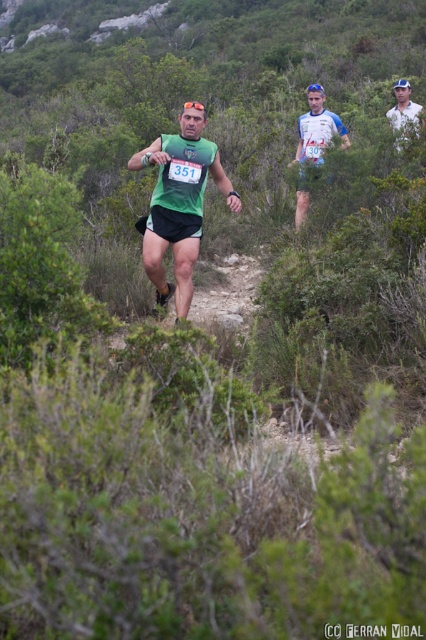
Question: Which point is farther to the camera?

Choices:
 (A) green matte running vest at center
 (B) white cotton shirt at upper right
 (C) matte green tank top at center

Answer: (B)

Question: Does green matte running vest at center come in front of white cotton shirt at upper right?

Choices:
 (A) no
 (B) yes

Answer: (B)

Question: Which object appears farthest from the camera in this image?

Choices:
 (A) matte green tank top at center
 (B) green matte running vest at center
 (C) white cotton shirt at upper right

Answer: (C)

Question: Which object is the closest to the green matte running vest at center?

Choices:
 (A) white cotton shirt at upper right
 (B) matte green tank top at center

Answer: (B)

Question: Can you confirm if green matte running vest at center is positioned to the right of white cotton shirt at upper right?

Choices:
 (A) yes
 (B) no

Answer: (B)

Question: Does matte green tank top at center appear on the right side of white cotton shirt at upper right?

Choices:
 (A) no
 (B) yes

Answer: (A)